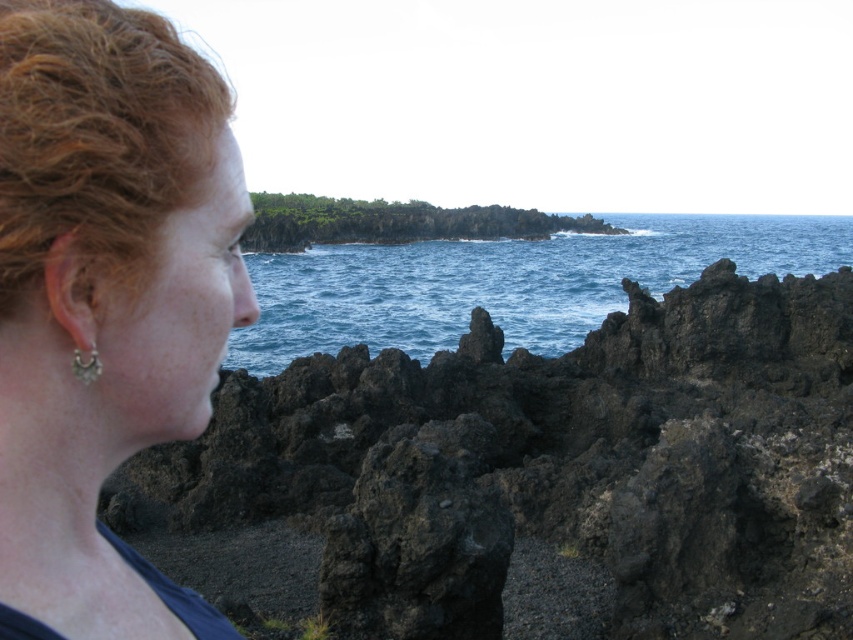
Can you confirm if black volcanic rock at center is positioned to the left of curly auburn hair at left?

Incorrect, black volcanic rock at center is not on the left side of curly auburn hair at left.

Identify the location of black volcanic rock at center. (552, 465).

Does black volcanic rock at center have a smaller size compared to matte black hair at left?

No.

Is black volcanic rock at center above matte black hair at left?

Yes.

Is point (242, 410) behind point (93, 54)?

Yes, point (242, 410) is behind point (93, 54).

Find the location of a particular element. Image resolution: width=853 pixels, height=640 pixels. black volcanic rock at center is located at coordinates (552, 465).

Is matte black hair at left above silver metallic earring at lower left?

No, matte black hair at left is not above silver metallic earring at lower left.

Does matte black hair at left have a greater height compared to silver metallic earring at lower left?

Correct, matte black hair at left is much taller as silver metallic earring at lower left.

Does point (57, 92) come in front of point (85, 376)?

Yes.

You are a GUI agent. You are given a task and a screenshot of the screen. Output one action in this format:
    pyautogui.click(x=<x>, y=<y>)
    Task: Click on the matte black hair at left
    The image size is (853, 640).
    Given the screenshot: What is the action you would take?
    pyautogui.click(x=105, y=300)